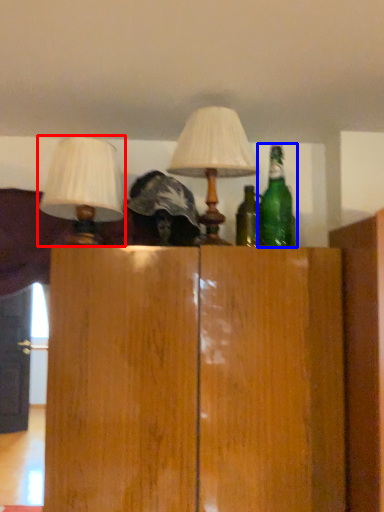
Question: Which object is closer to the camera taking this photo, lamp (highlighted by a red box) or bottle (highlighted by a blue box)?

Choices:
 (A) lamp
 (B) bottle

Answer: (A)